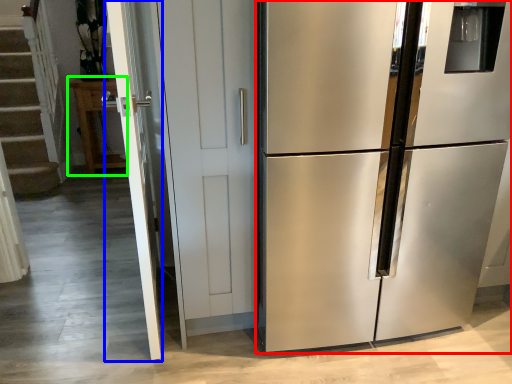
Question: Estimate the real-world distances between objects in this image. Which object is closer to refrigerator (highlighted by a red box), screen door (highlighted by a blue box) or cabinetry (highlighted by a green box)?

Choices:
 (A) screen door
 (B) cabinetry

Answer: (A)